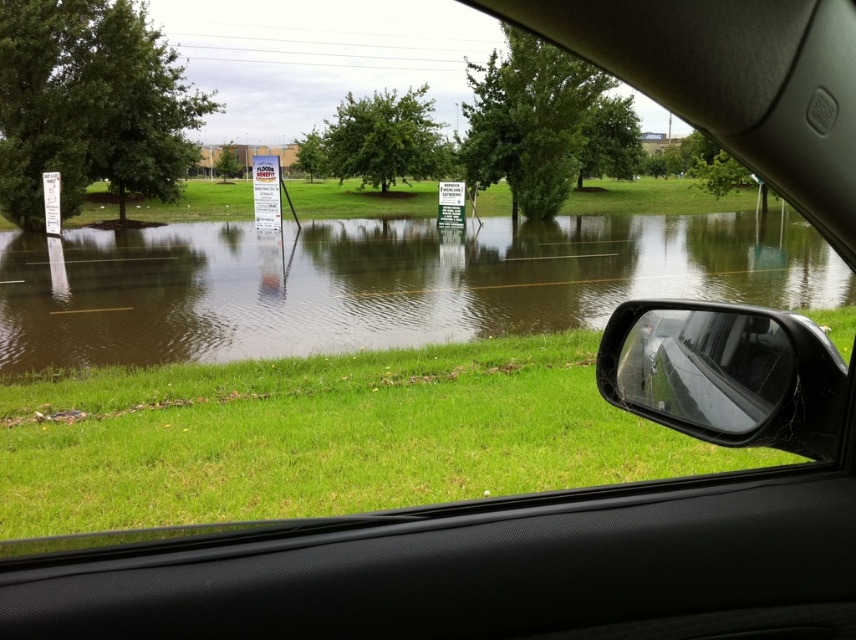
Where is `brown murky water at lower left`? brown murky water at lower left is located at coordinates tap(379, 282).

Does brown murky water at lower left have a smaller size compared to transparent glass side mirror at lower right?

Actually, brown murky water at lower left might be larger than transparent glass side mirror at lower right.

Between point (62, 305) and point (736, 364), which one is positioned in front?

Point (736, 364) is more forward.

Identify the location of brown murky water at lower left. (379, 282).